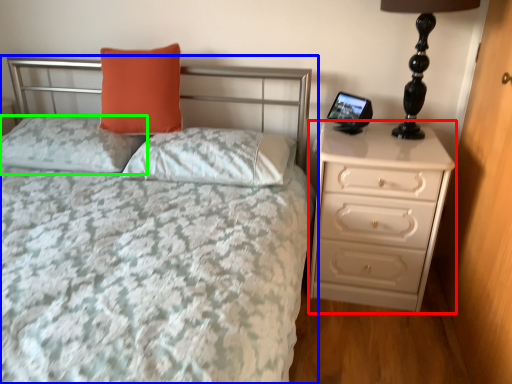
Question: Which object is positioned closest to chest of drawers (highlighted by a red box)? Select from bed (highlighted by a blue box) and pillow (highlighted by a green box).

Choices:
 (A) bed
 (B) pillow

Answer: (A)